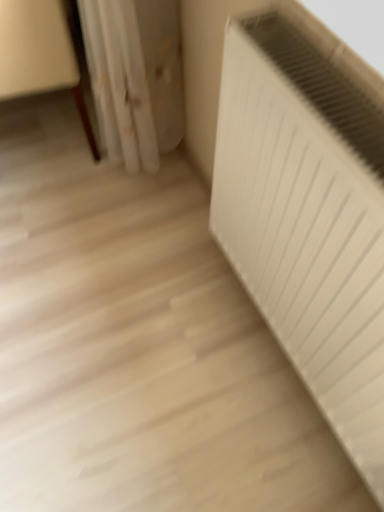
You are a GUI agent. You are given a task and a screenshot of the screen. Output one action in this format:
    pyautogui.click(x=<x>, y=<y>)
    Task: Click on the vacant region below wooden floor at lower left (from a real-world perspective)
    
    Given the screenshot: What is the action you would take?
    pyautogui.click(x=37, y=138)